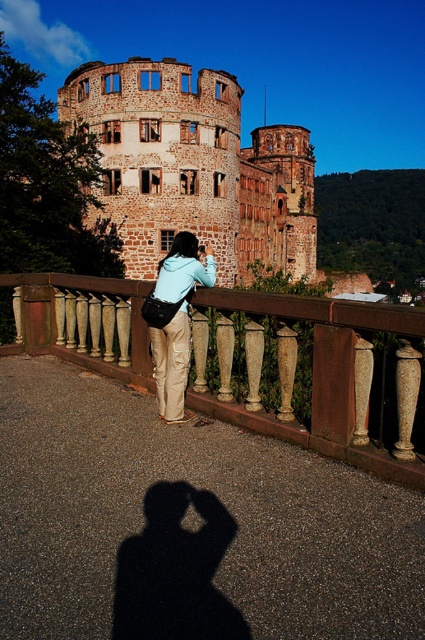
Is brown wood railing at center above matte blue jacket at center?

Actually, brown wood railing at center is below matte blue jacket at center.

Who is higher up, brown wood railing at center or matte blue jacket at center?

matte blue jacket at center

You are a GUI agent. You are given a task and a screenshot of the screen. Output one action in this format:
    pyautogui.click(x=<x>, y=<y>)
    Task: Click on the brown wood railing at center
    The image size is (425, 640).
    Given the screenshot: What is the action you would take?
    pyautogui.click(x=311, y=374)